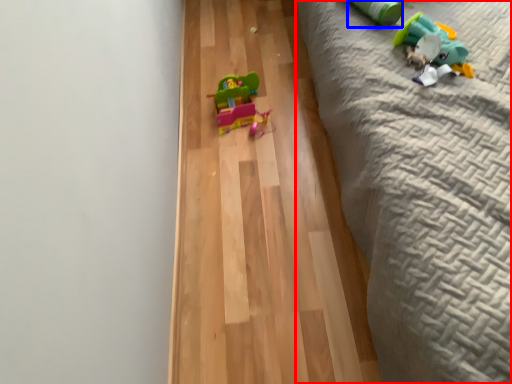
Question: Which object is further to the camera taking this photo, bed (highlighted by a red box) or toy (highlighted by a blue box)?

Choices:
 (A) bed
 (B) toy

Answer: (B)